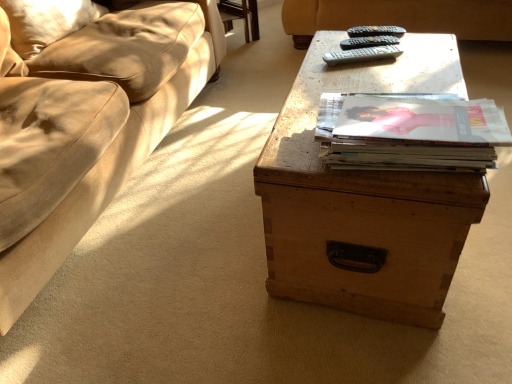
Where is `free location to the right of black plastic remote at upper center, the second remote when ordered from bottom to top`? free location to the right of black plastic remote at upper center, the second remote when ordered from bottom to top is located at coordinates click(422, 43).